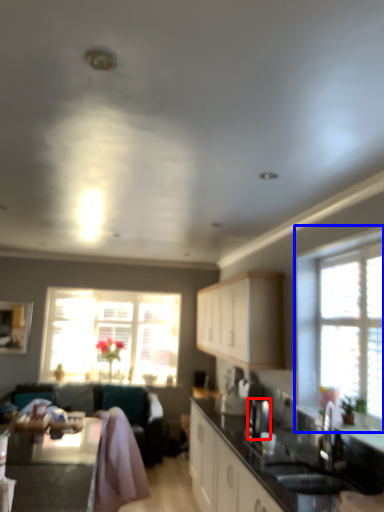
Question: Which of the following is the farthest to the observer, appliance (highlighted by a red box) or window (highlighted by a blue box)?

Choices:
 (A) appliance
 (B) window

Answer: (A)